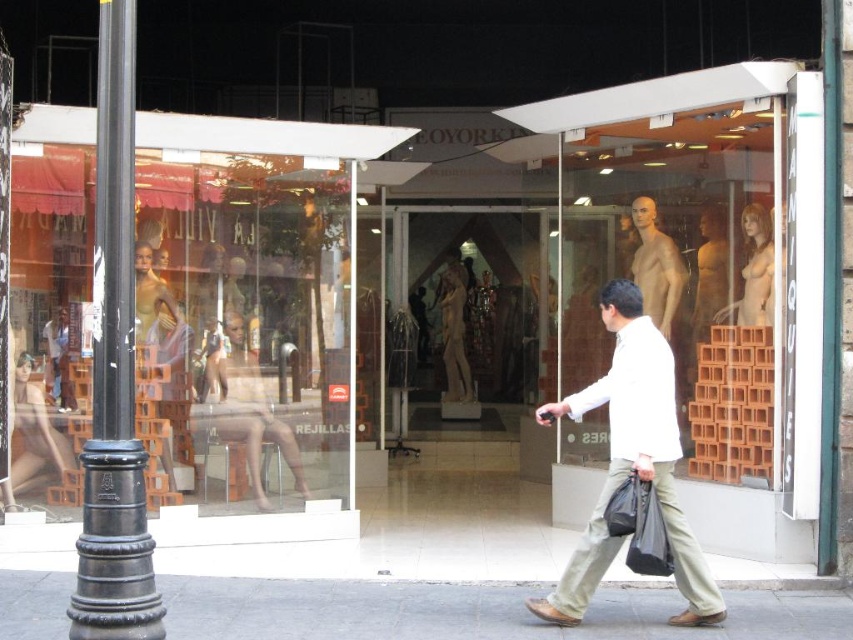
You are a delivery person standing outside the store entrance. You need to place a small package on the counter near the smooth beige mannequin at center. The counter is located at point coordinates of (244, 404). Can you confirm if the counter is near the smooth beige mannequin at center?

Yes, the point coordinates (244, 404) mark the location of the smooth beige mannequin at center, so the counter is indeed near it.

You are a delivery person carrying a package that needs to be placed exactly between the smooth beige mannequin at center and the matte beige dress at center. Given that the minimum distance required for safe placement is 5 meters, can you safely place the package between them?

The distance between the smooth beige mannequin at center and the matte beige dress at center is 6.56 meters, which exceeds the minimum required 5 meters for safe placement. Therefore, you can safely place the package between them.

You are a delivery person who needs to place a new dress in the store window. The dress must be placed above the smooth beige mannequin at center. Is the matte beige dress at center currently positioned correctly?

The smooth beige mannequin at center is below the matte beige dress at center, so the matte beige dress at center is already positioned correctly above the smooth beige mannequin at center.